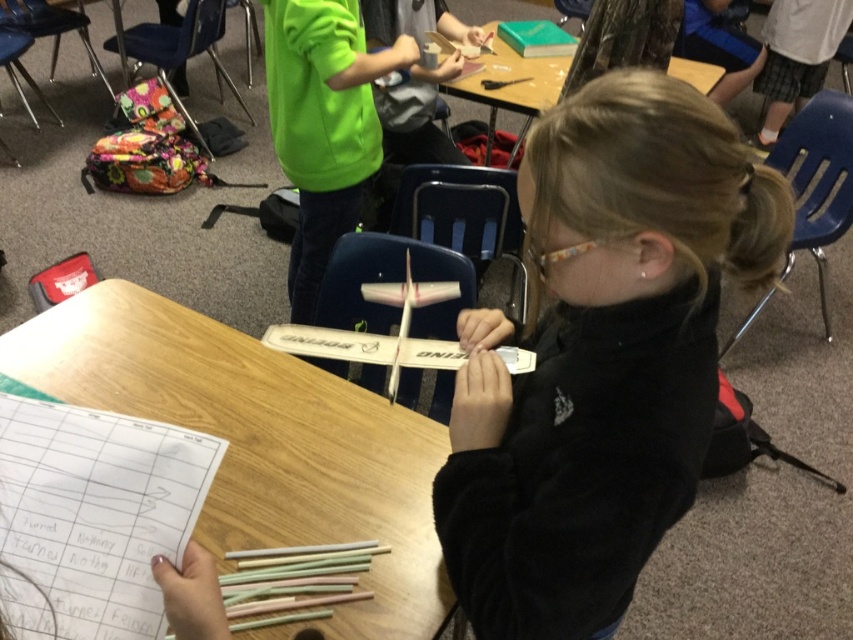
Question: Does wooden table at center lie in front of white paper at upper left?

Choices:
 (A) no
 (B) yes

Answer: (A)

Question: Which of the following is the closest to the observer?

Choices:
 (A) (674, 70)
 (B) (553, 477)

Answer: (B)

Question: Which object is positioned farthest from the green matte book at upper center?

Choices:
 (A) white paper at upper left
 (B) wooden table at center
 (C) black matte airplane at center

Answer: (A)

Question: Does wooden table at center come behind white paper at upper left?

Choices:
 (A) no
 (B) yes

Answer: (B)

Question: Is wooden table at center thinner than green matte book at upper center?

Choices:
 (A) yes
 (B) no

Answer: (B)

Question: Which object is positioned closest to the white paper at upper left?

Choices:
 (A) green matte book at upper center
 (B) black matte airplane at center

Answer: (B)